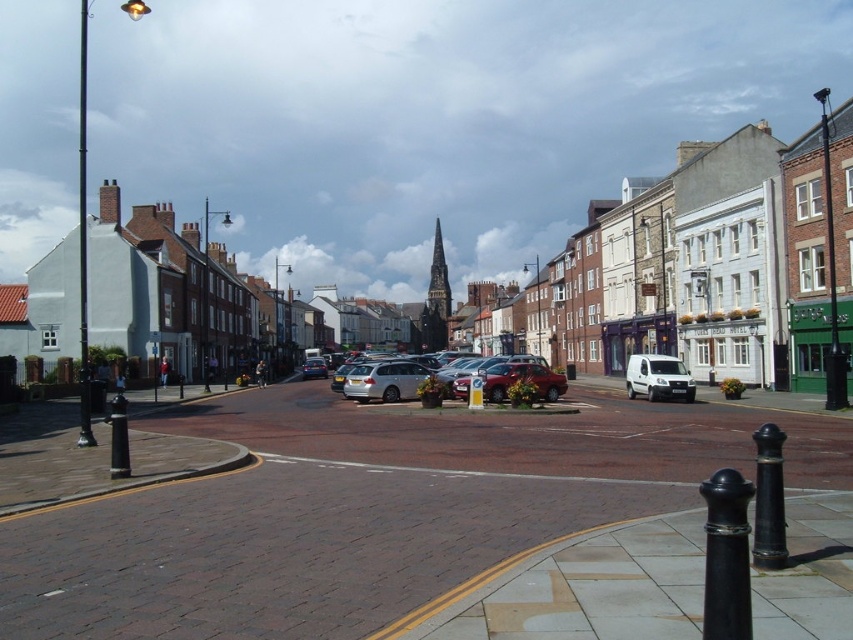
Question: Is silver metallic hatchback at center wider than white matte van at center?

Choices:
 (A) no
 (B) yes

Answer: (B)

Question: Can you confirm if matte brick road at center is bigger than white matte van at center?

Choices:
 (A) yes
 (B) no

Answer: (A)

Question: Which object is positioned farthest from the silver metallic hatchback at center?

Choices:
 (A) brick pavement at center
 (B) white matte van at center
 (C) matte brick road at center

Answer: (C)

Question: Can you confirm if matte brick road at center is bigger than white matte van at center?

Choices:
 (A) yes
 (B) no

Answer: (A)

Question: Which of these objects is positioned closest to the white matte van at center?

Choices:
 (A) brick pavement at center
 (B) silver metallic hatchback at center

Answer: (B)

Question: Which object is positioned farthest from the white matte van at center?

Choices:
 (A) silver metallic hatchback at center
 (B) matte brick road at center
 (C) brick pavement at center

Answer: (B)